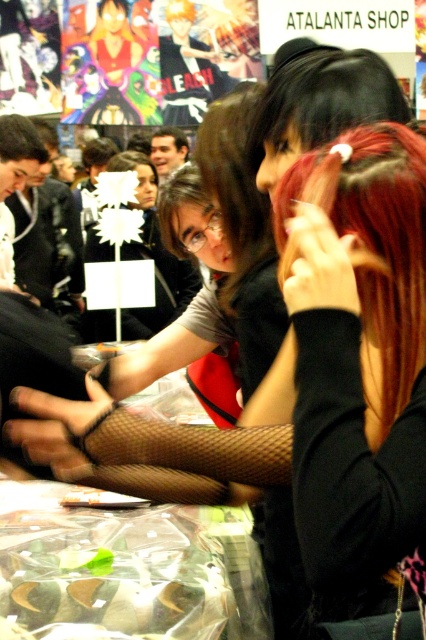
You are a photographer at the event and want to focus on both the person with long dark hair and the person with red hair. Which of the two points, point (386, 288) or point (247, 124), is closer to your camera lens?

Point (386, 288) is closer to the camera lens than point (247, 124).

You are at an anime convention and see two people, brownhair at center and dark brown hair at upper left. Which one is more to the right?

The brownhair at center is more to the right because it is positioned on the right side of dark brown hair at upper left.

Based on the scene description, where is the shiny red hair at center located in terms of its 2D coordinates?

The shiny red hair at center is located at the 2D coordinates of point (362, 356).